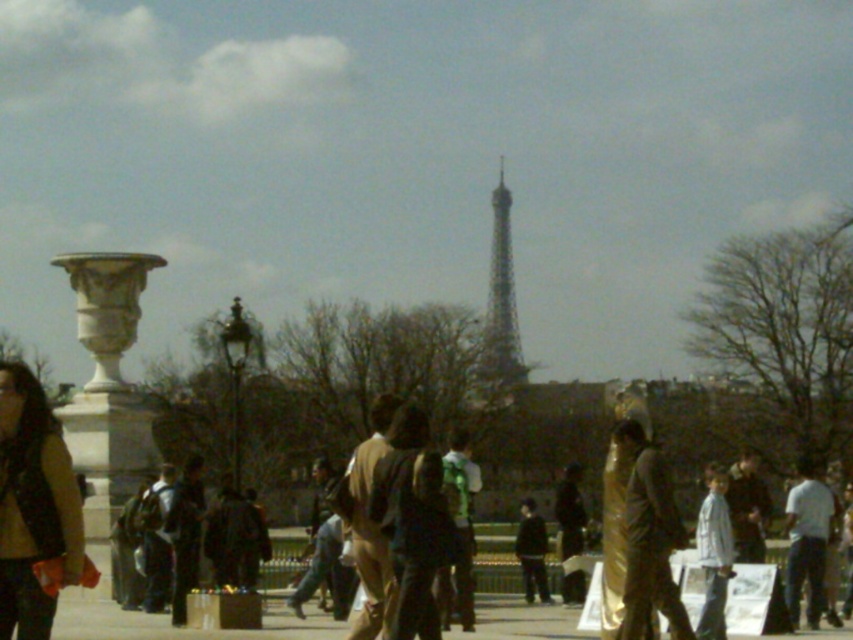
In the scene shown: Who is taller, brown leather jacket at left or dark brown leather jacket at center?

brown leather jacket at left

Between brown leather jacket at left and dark brown leather jacket at center, which one is positioned lower?

dark brown leather jacket at center is lower down.

Which is in front, point (67, 502) or point (531, 577)?

Point (67, 502) is more forward.

The height and width of the screenshot is (640, 853). Identify the location of brown leather jacket at left. (35, 509).

Is gold metallic statue at center closer to camera compared to metallic silver tower at center?

Yes.

What do you see at coordinates (648, 538) in the screenshot? I see `gold metallic statue at center` at bounding box center [648, 538].

Is point (636, 452) behind point (496, 282)?

No, it is not.

The width and height of the screenshot is (853, 640). Identify the location of gold metallic statue at center. (648, 538).

Does gold metallic statue at center have a greater width compared to dark brown leather jacket at center?

Correct, the width of gold metallic statue at center exceeds that of dark brown leather jacket at center.

Which is below, gold metallic statue at center or dark brown leather jacket at center?

Positioned lower is dark brown leather jacket at center.

Who is more distant from viewer, (631, 440) or (523, 561)?

The point (523, 561) is more distant.

At what (x,y) coordinates should I click in order to perform the action: click on gold metallic statue at center. Please return your answer as a coordinate pair (x, y). Looking at the image, I should click on (648, 538).